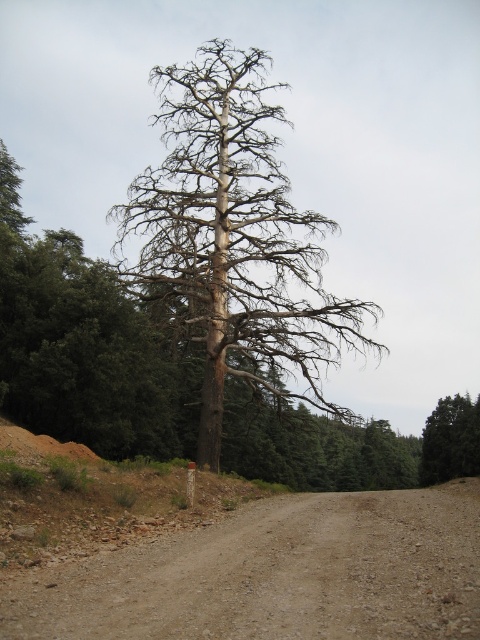
Can you confirm if brown gravel dirt track at center is thinner than bare wood tree at center?

Correct, brown gravel dirt track at center's width is less than bare wood tree at center's.

Can you confirm if brown gravel dirt track at center is taller than bare wood tree at center?

No, brown gravel dirt track at center is not taller than bare wood tree at center.

Between point (415, 528) and point (238, 368), which one is positioned in front?

Point (415, 528) is more forward.

At what (x,y) coordinates should I click in order to perform the action: click on brown gravel dirt track at center. Please return your answer as a coordinate pair (x, y). The height and width of the screenshot is (640, 480). Looking at the image, I should click on (276, 573).

Can you confirm if bare wood tree at center is bigger than green matte tree at center?

No.

Can you confirm if bare wood tree at center is positioned above green matte tree at center?

Yes, bare wood tree at center is above green matte tree at center.

I want to click on bare wood tree at center, so click(x=233, y=240).

Is brown gravel dirt track at center to the right of green matte tree at center from the viewer's perspective?

No, brown gravel dirt track at center is not to the right of green matte tree at center.

Which is in front, point (319, 577) or point (442, 416)?

Positioned in front is point (319, 577).

Locate an element on the screen. The image size is (480, 640). brown gravel dirt track at center is located at coordinates (276, 573).